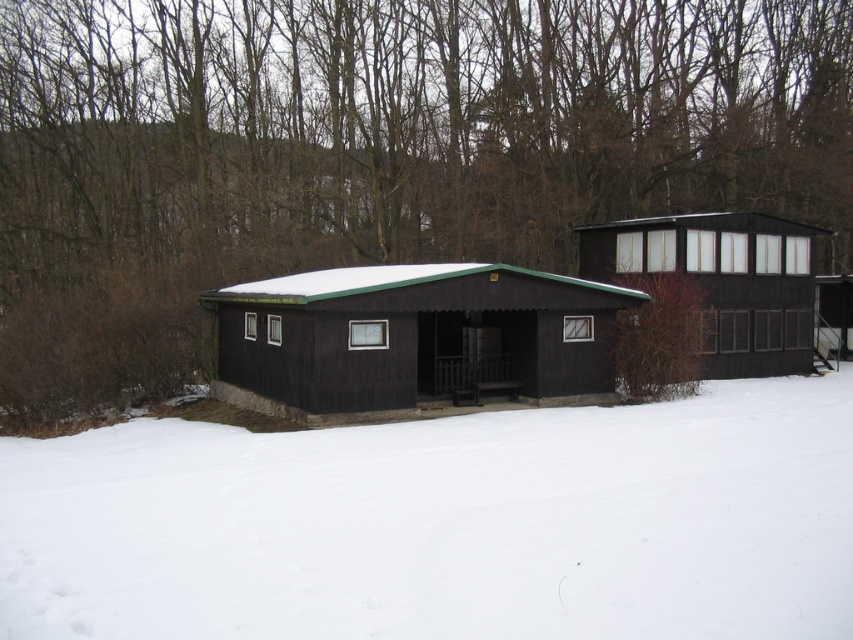
You are standing in the snowy landscape and want to walk from the brown wood tree at upper center to the matte black cabin at upper right. Which direction should you head?

You should head to the right because the brown wood tree at upper center is to the left of the matte black cabin at upper right.

You are standing at the base of the brown wood tree at upper center and want to walk to the matte black cabin at center. Which direction should you face to walk directly towards the cabin?

Since the brown wood tree at upper center is taller than the matte black cabin at center, you should face downward to walk directly towards the matte black cabin at center.